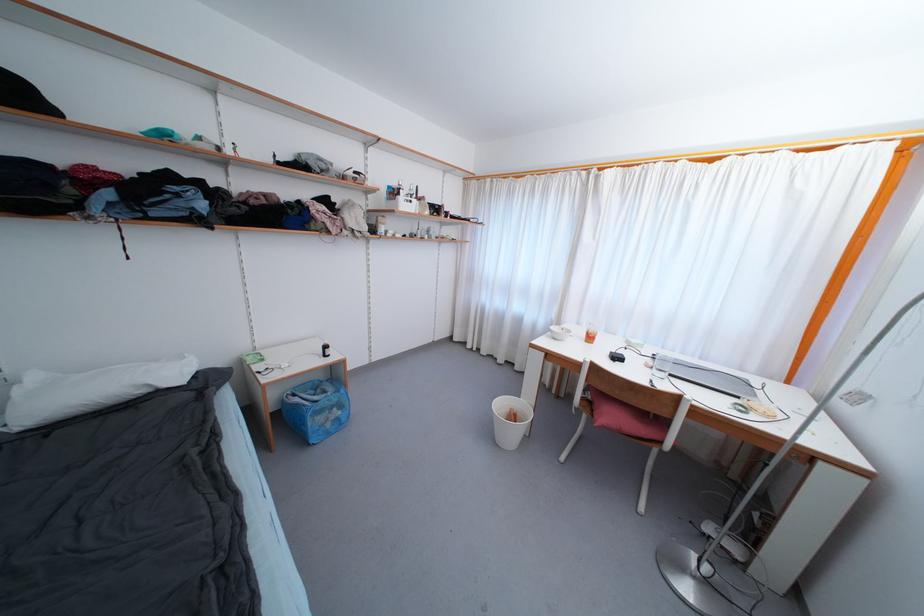
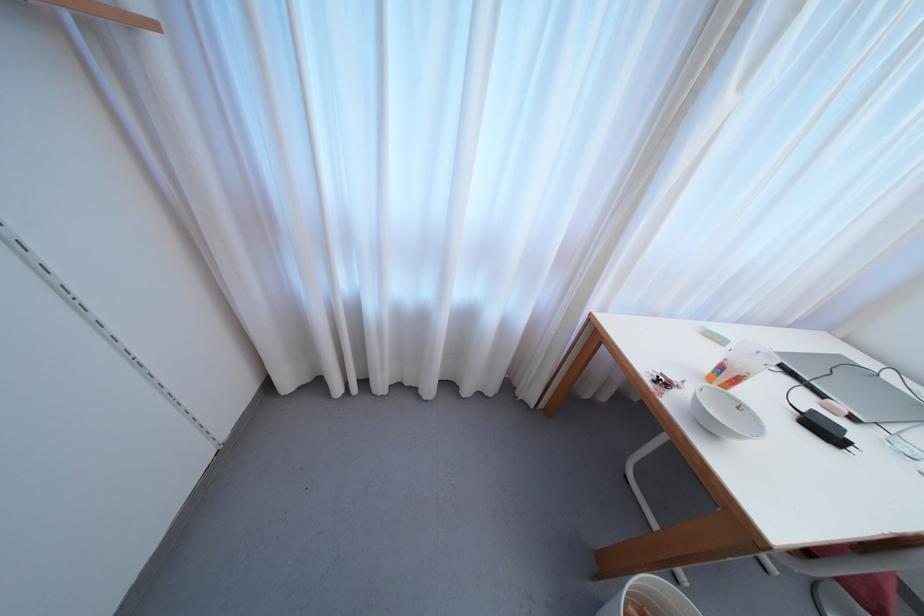
In the second image, find the point that corresponds to point 473,349 in the first image.

(342, 392)